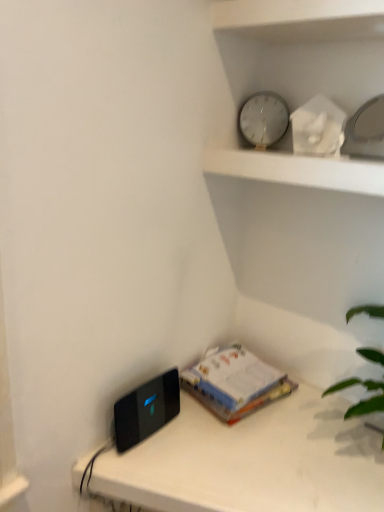
The image size is (384, 512). In order to click on vacant space to the right of white paper at center in this screenshot , I will do `click(311, 412)`.